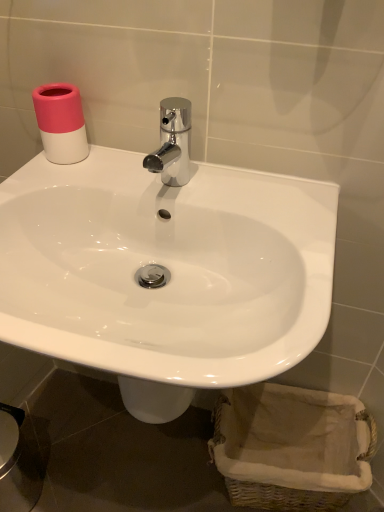
In order to click on spots to the right of chrome metallic faucet at center in this screenshot , I will do `click(256, 200)`.